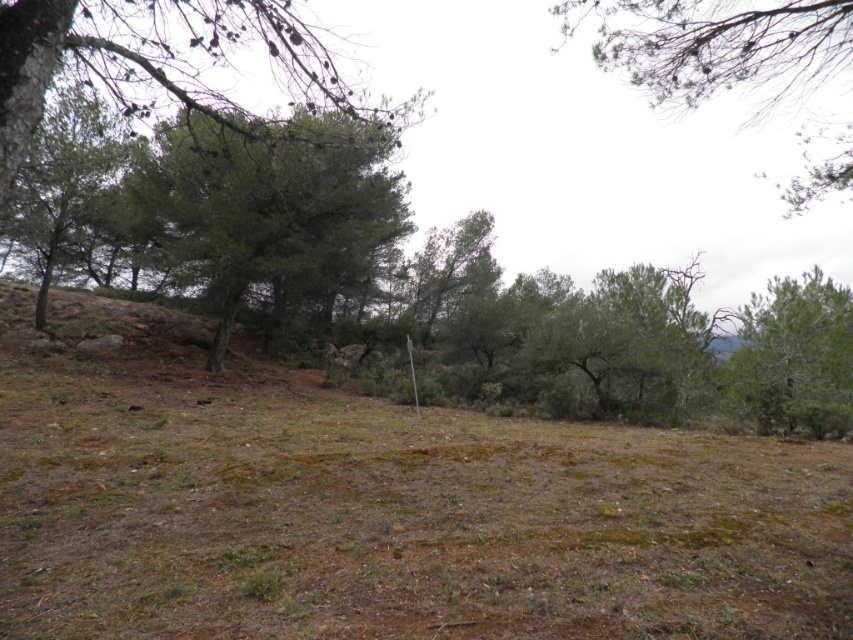
Consider the image. Which of these two, green textured tree at center or green leafy tree at upper center, stands taller?

green leafy tree at upper center is taller.

Measure the distance from green textured tree at center to green leafy tree at upper center.

The distance of green textured tree at center from green leafy tree at upper center is 10.12 meters.

Describe the element at coordinates (265, 211) in the screenshot. I see `green textured tree at center` at that location.

The width and height of the screenshot is (853, 640). Identify the location of green textured tree at center. (265, 211).

Looking at this image, can you confirm if green leafy tree at upper center is positioned to the right of green textured tree at right?

Correct, you'll find green leafy tree at upper center to the right of green textured tree at right.

Looking at this image, is green leafy tree at upper center smaller than green textured tree at right?

No, green leafy tree at upper center is not smaller than green textured tree at right.

What do you see at coordinates (718, 45) in the screenshot? This screenshot has height=640, width=853. I see `green leafy tree at upper center` at bounding box center [718, 45].

The image size is (853, 640). I want to click on green leafy tree at upper center, so click(x=718, y=45).

Is point (219, 196) positioned after point (801, 364)?

Yes.

Which is more to the left, green textured tree at center or green textured tree at right?

green textured tree at center is more to the left.

I want to click on green textured tree at center, so click(265, 211).

Where is `green textured tree at center`? green textured tree at center is located at coordinates (265, 211).